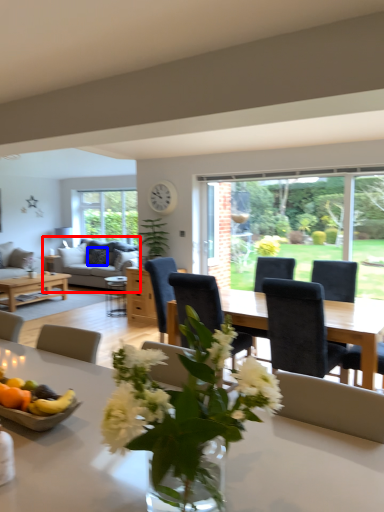
Question: Which point is closer to the camera, studio couch (highlighted by a red box) or pillow (highlighted by a blue box)?

Choices:
 (A) studio couch
 (B) pillow

Answer: (A)